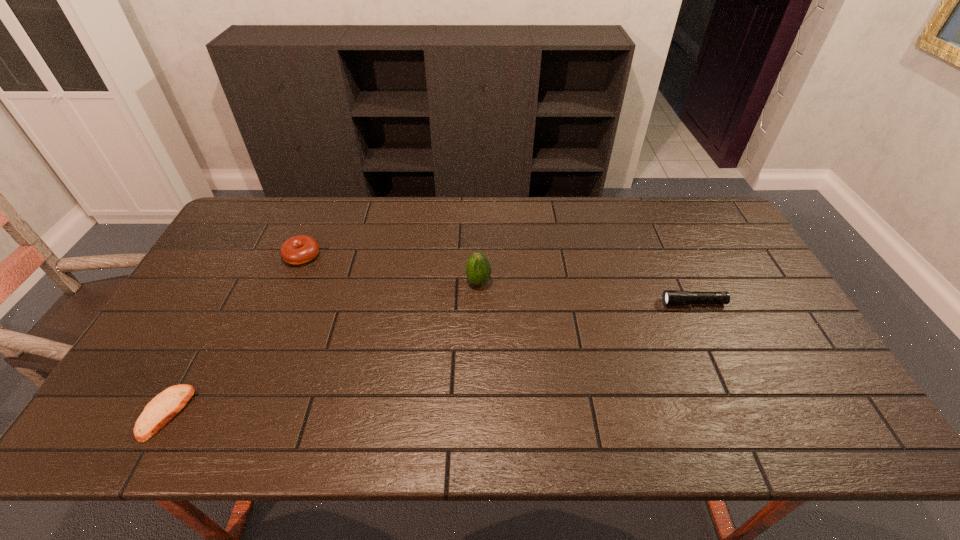
Where is `free space located at the lens end of the third farthest object`? free space located at the lens end of the third farthest object is located at coordinates (628, 303).

Where is `free space located at the lens end of the third farthest object`? free space located at the lens end of the third farthest object is located at coordinates (611, 303).

What are the coordinates of `free location located at the lens end of the third farthest object` in the screenshot? It's located at (583, 303).

I want to click on vacant area situated 0.100m on the right of the pita bread, so click(x=230, y=413).

Identify the location of object that is at the near edge. The image size is (960, 540). [x=166, y=405].

At what (x,y) coordinates should I click in order to perform the action: click on object that is at the left edge. Please return your answer as a coordinate pair (x, y). This screenshot has width=960, height=540. Looking at the image, I should click on (166, 405).

Locate an element on the screen. object positioned at the right edge is located at coordinates (669, 297).

Image resolution: width=960 pixels, height=540 pixels. Find the location of `object that is at the near left corner`. object that is at the near left corner is located at coordinates (166, 405).

You are a GUI agent. You are given a task and a screenshot of the screen. Output one action in this format:
    pyautogui.click(x=<x>, y=<y>)
    Task: Click on the vacant space at the far edge
    The image size is (960, 540).
    Given the screenshot: What is the action you would take?
    pyautogui.click(x=469, y=214)

Identify the location of vacant space at the left edge. The height and width of the screenshot is (540, 960). (247, 265).